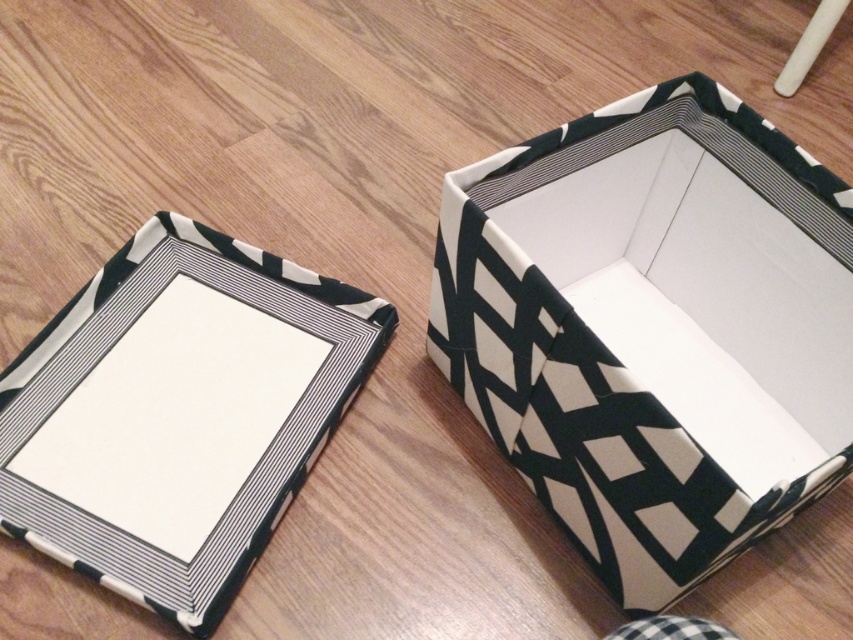
Question: Is black and white patterned cardboard box at center smaller than black and white patterned box at center?

Choices:
 (A) yes
 (B) no

Answer: (B)

Question: Which object appears closest to the camera in this image?

Choices:
 (A) black and white patterned cardboard box at center
 (B) black and white patterned box at center

Answer: (A)

Question: Which of the following is the closest to the observer?

Choices:
 (A) (183, 564)
 (B) (524, 157)

Answer: (B)

Question: Does black and white patterned cardboard box at center appear over black and white patterned box at center?

Choices:
 (A) no
 (B) yes

Answer: (B)

Question: Considering the relative positions of black and white patterned cardboard box at center and black and white patterned box at center in the image provided, where is black and white patterned cardboard box at center located with respect to black and white patterned box at center?

Choices:
 (A) above
 (B) below

Answer: (A)